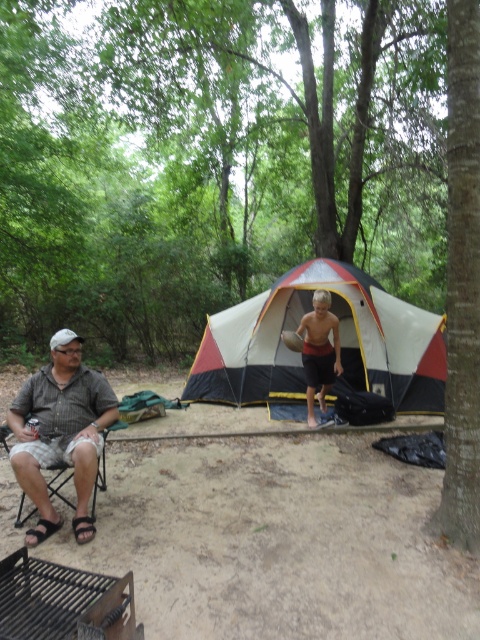
Who is positioned more to the right, white canvas tent at center or shiny brown shorts at center?

Positioned to the right is white canvas tent at center.

Is point (291, 364) positioned behind point (333, 321)?

Yes, it is behind point (333, 321).

Where is `white canvas tent at center`? Image resolution: width=480 pixels, height=640 pixels. white canvas tent at center is located at coordinates (340, 342).

Does shiny brown shorts at center appear over matte gray folding chair at left?

Yes, shiny brown shorts at center is above matte gray folding chair at left.

In the scene shown: Does shiny brown shorts at center have a smaller size compared to matte gray folding chair at left?

Incorrect, shiny brown shorts at center is not smaller in size than matte gray folding chair at left.

Where is `shiny brown shorts at center`? shiny brown shorts at center is located at coordinates (320, 353).

Which is more to the left, gray striped shirt at left or shiny brown shorts at center?

gray striped shirt at left is more to the left.

From the picture: Can you confirm if gray striped shirt at left is taller than shiny brown shorts at center?

In fact, gray striped shirt at left may be shorter than shiny brown shorts at center.

Is point (48, 531) positioned before point (333, 332)?

That is True.

The image size is (480, 640). I want to click on gray striped shirt at left, so click(60, 433).